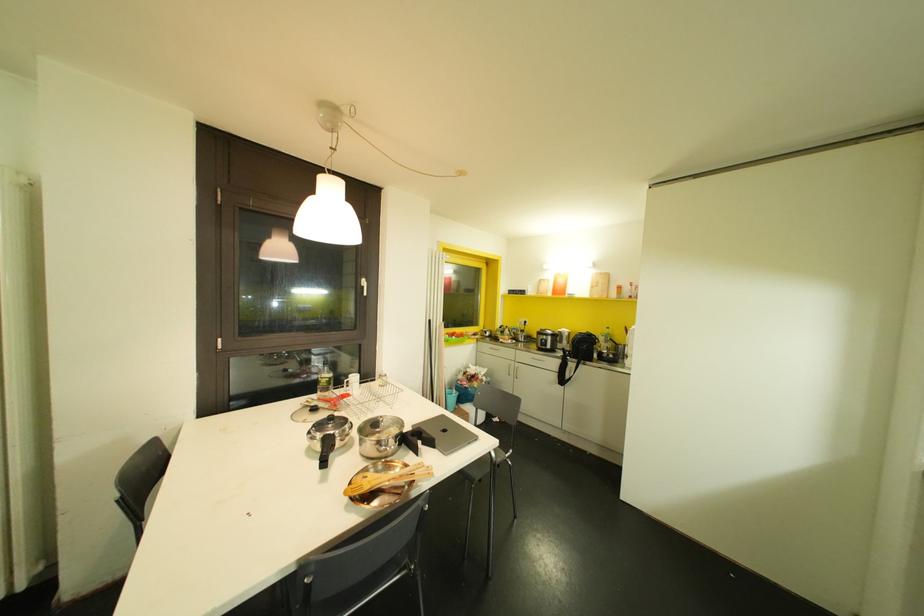
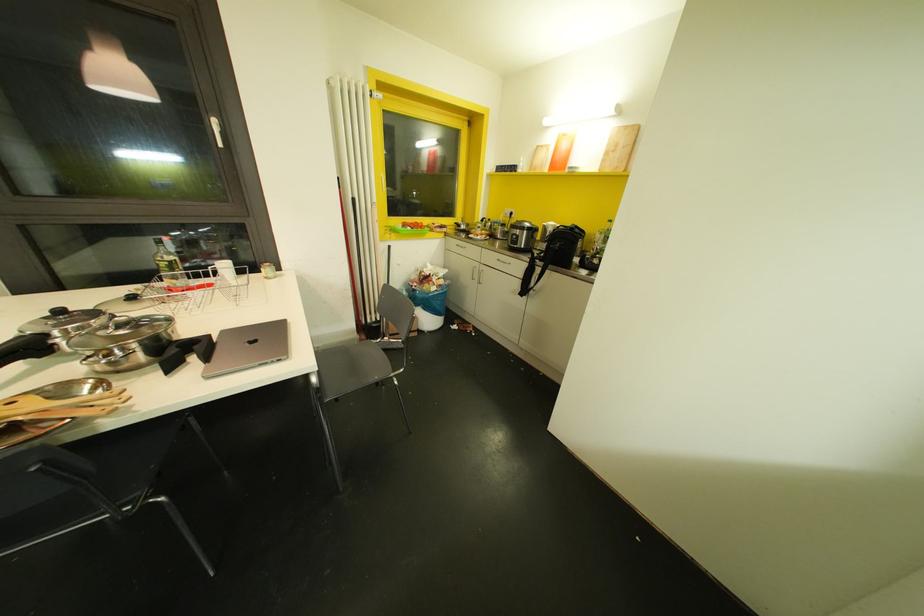
The point at (363, 294) is marked in the first image. Where is the corresponding point in the second image?

(220, 145)